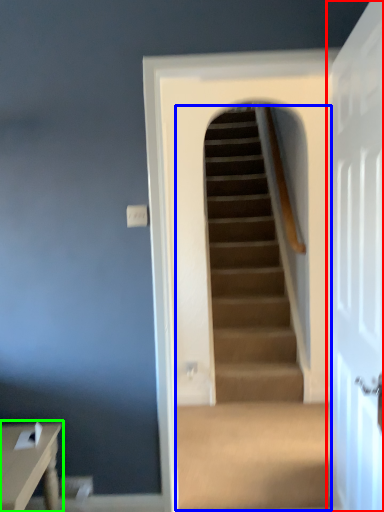
Question: Considering the real-world distances, which object is closest to door (highlighted by a red box)? escalator (highlighted by a blue box) or table (highlighted by a green box).

Choices:
 (A) escalator
 (B) table

Answer: (B)